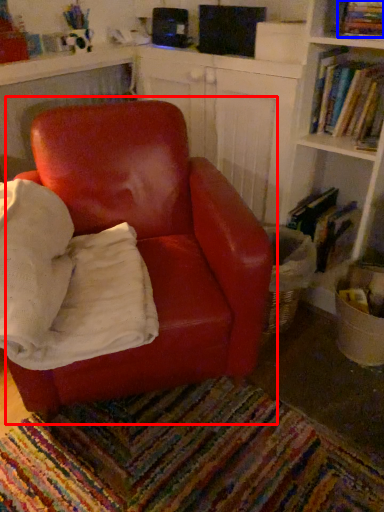
Question: Which point is further to the camera, chair (highlighted by a red box) or book (highlighted by a blue box)?

Choices:
 (A) chair
 (B) book

Answer: (B)